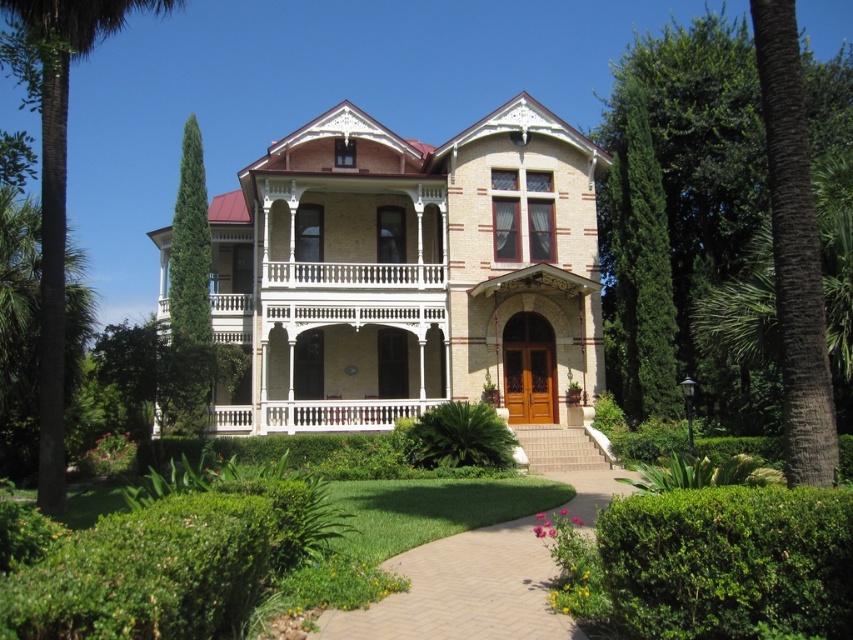
You are standing in front of the Victorian house and want to know which tree is closer to you. The trees are the green leafy tree at right and the green leafy palm tree at left. Based on their positions, which one is closer?

The green leafy palm tree at left is closer to you because it is positioned below the green leafy tree at right, indicating it is in front.

You are standing in front of the Victorian house and want to walk to the front door. Where should you look for the brick pathway at center?

The brick pathway at center is located at the coordinates point (x=463, y=592).

Based on the photo, you are standing in front of the Victorian house and want to plant a new tree exactly where the green leafy tree at right is currently located. What are the coordinates of the spot where you should plant the new tree?

The coordinates for the green leafy tree at right are at point (706,186), so you should plant the new tree at those coordinates.